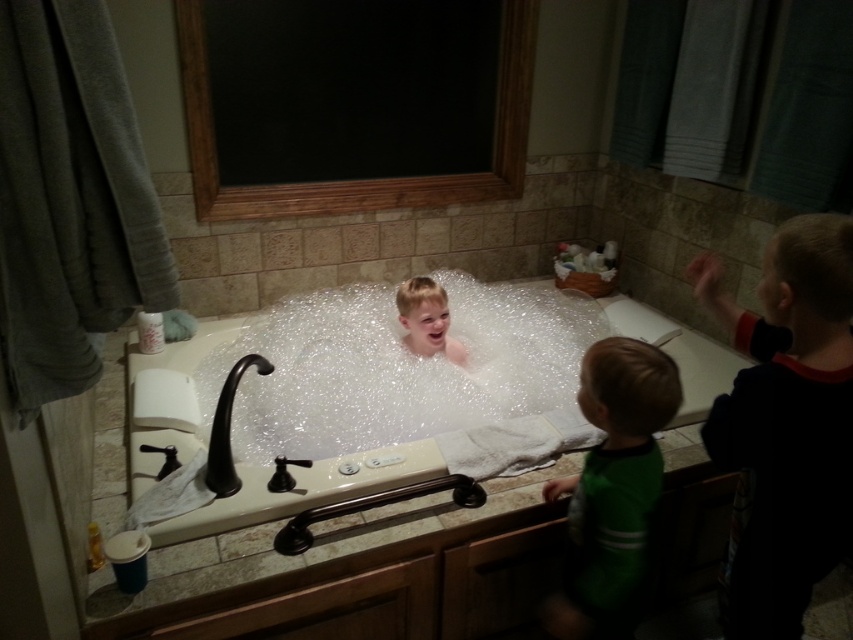
Question: Which point is closer to the camera taking this photo?

Choices:
 (A) (427, 332)
 (B) (547, 628)
 (C) (541, 371)

Answer: (B)

Question: Can you confirm if black cotton shirt at upper right is positioned above translucent plastic boy at center?

Choices:
 (A) no
 (B) yes

Answer: (A)

Question: Which object is farther from the camera taking this photo?

Choices:
 (A) green cotton shirt at lower right
 (B) black cotton shirt at upper right

Answer: (A)

Question: Which point is farther from the camera taking this photo?

Choices:
 (A) (769, 256)
 (B) (167, 541)

Answer: (B)

Question: Is clear bubble foam at center smaller than green cotton shirt at lower right?

Choices:
 (A) no
 (B) yes

Answer: (A)

Question: Is clear bubble foam at center further to camera compared to black cotton shirt at upper right?

Choices:
 (A) no
 (B) yes

Answer: (B)